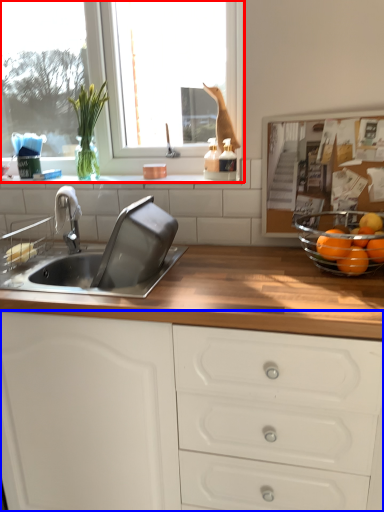
Question: Which point is closer to the camera, window (highlighted by a red box) or cabinetry (highlighted by a blue box)?

Choices:
 (A) window
 (B) cabinetry

Answer: (B)